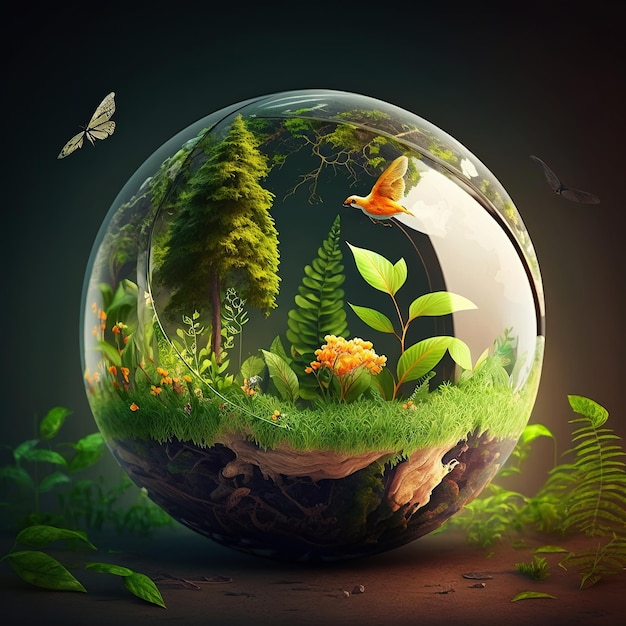
The image size is (626, 626). Identify the location of glass sphere terrarium. (307, 173).